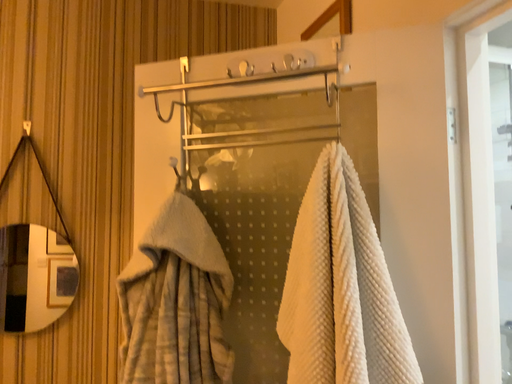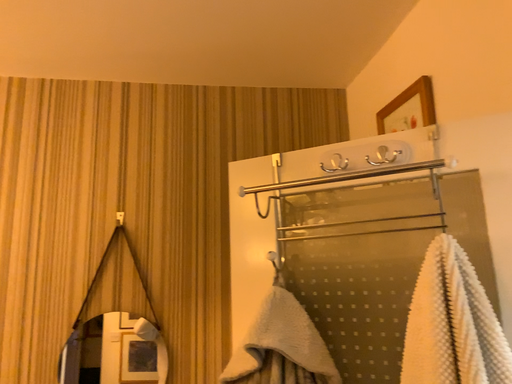
Question: How did the camera likely rotate when shooting the video?

Choices:
 (A) rotated downward
 (B) rotated upward

Answer: (B)